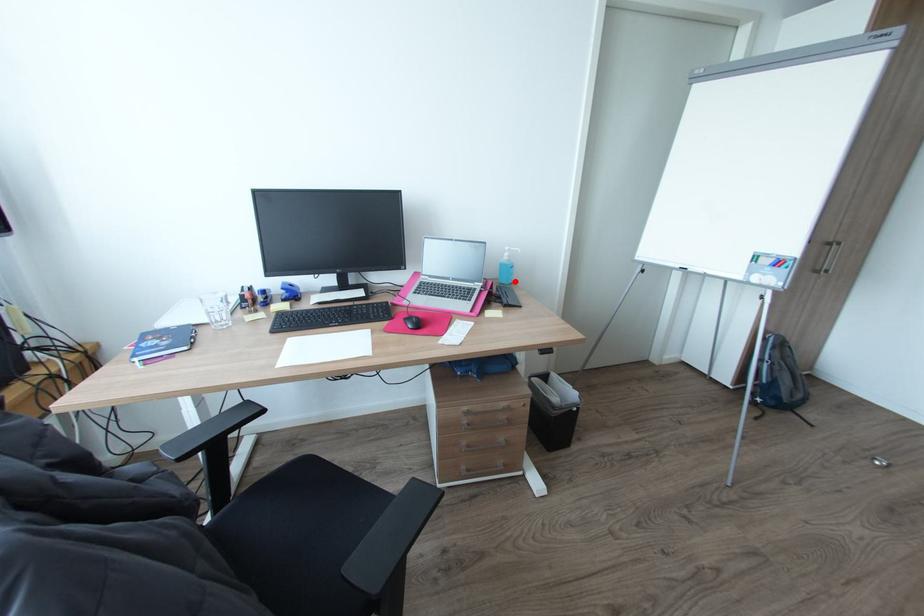
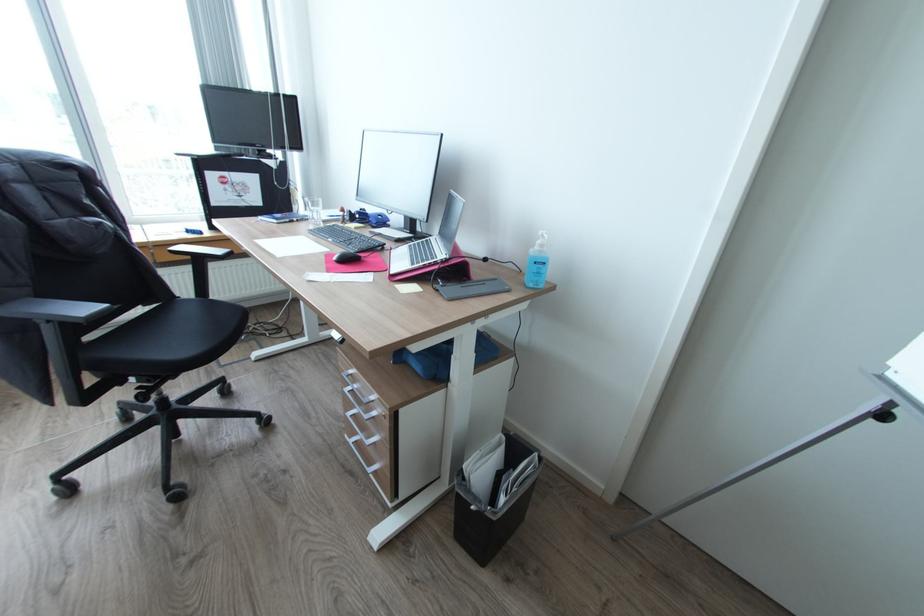
Where in the second image is the point corresponding to the highlighted location from the first image?

(536, 284)